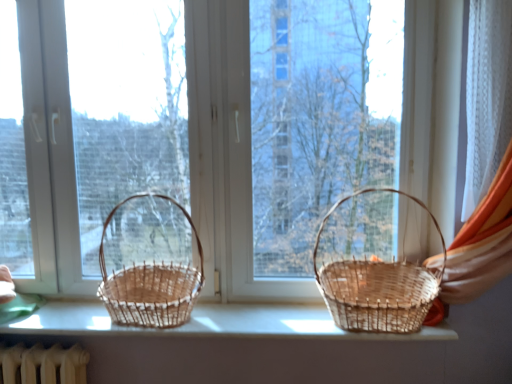
Question: Is point (309, 306) positioned closer to the camera than point (212, 269)?

Choices:
 (A) closer
 (B) farther

Answer: (A)

Question: From the image's perspective, is woven wood baskets at center located above or below natural wood baskets at center?

Choices:
 (A) below
 (B) above

Answer: (A)

Question: Estimate the real-world distances between objects in this image. Which object is farther from the woven brown picnic basket at left, which ranks as the 2th picnic basket in right-to-left order?

Choices:
 (A) woven natural basket at right, placed as the 1th picnic basket when sorted from right to left
 (B) natural wood baskets at center
 (C) woven wood baskets at center

Answer: (A)

Question: Which object is positioned farthest from the natural wood baskets at center?

Choices:
 (A) woven brown picnic basket at left, which ranks as the 2th picnic basket in right-to-left order
 (B) woven natural basket at right, placed as the 1th picnic basket when sorted from right to left
 (C) woven wood baskets at center

Answer: (C)